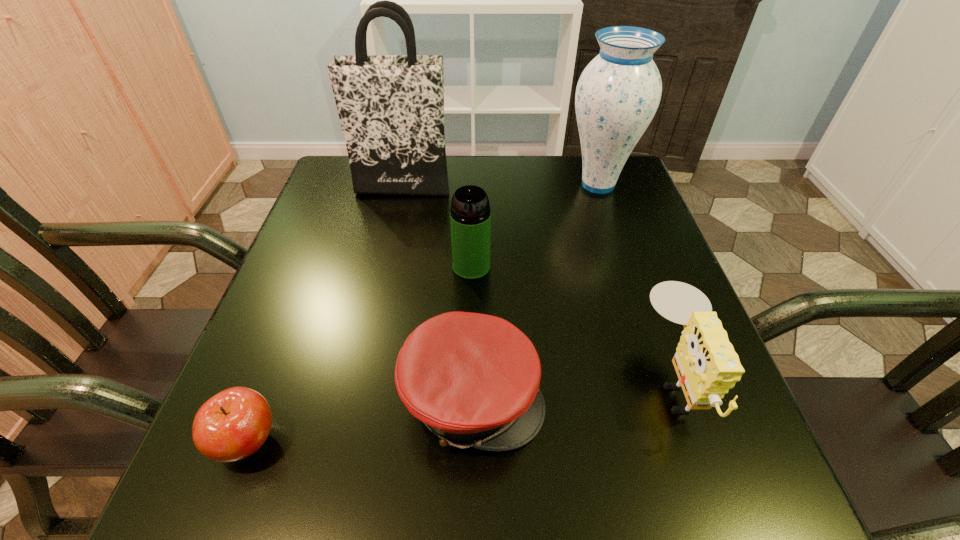
This screenshot has width=960, height=540. In order to click on vacant area situated 0.190m on the front-facing side of the sponge in this screenshot , I will do `click(533, 380)`.

Locate an element on the screen. The image size is (960, 540). free space located on the front-facing side of the sponge is located at coordinates (509, 380).

Locate an element on the screen. The width and height of the screenshot is (960, 540). free space located on the front-facing side of the sponge is located at coordinates (544, 380).

The width and height of the screenshot is (960, 540). What are the coordinates of `vacant space located on the front of the cap with an emblem` in the screenshot? It's located at (588, 396).

This screenshot has height=540, width=960. I want to click on free spot located 0.190m on the right of the apple, so click(406, 441).

The width and height of the screenshot is (960, 540). I want to click on shopping bag positioned at the far edge, so click(391, 107).

This screenshot has width=960, height=540. Identify the location of vase at the far edge. (617, 95).

Find the location of a particular element. The image size is (960, 540). cap situated at the near edge is located at coordinates pyautogui.click(x=473, y=379).

Find the location of a particular element. Image resolution: width=960 pixels, height=540 pixels. apple that is at the near edge is located at coordinates (232, 425).

You are a GUI agent. You are given a task and a screenshot of the screen. Output one action in this format:
    pyautogui.click(x=<x>, y=<y>)
    Task: Click on the shopping bag positioned at the left edge
    Image resolution: width=960 pixels, height=540 pixels.
    Given the screenshot: What is the action you would take?
    pyautogui.click(x=391, y=107)